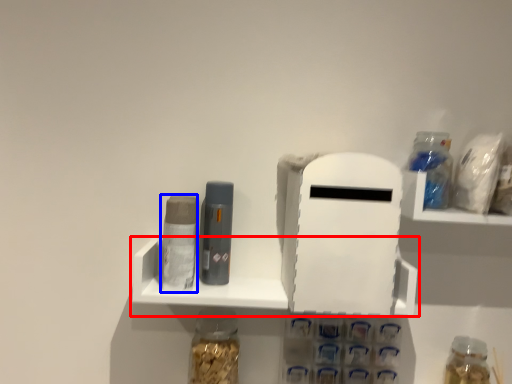
Question: Which of the following is the farthest to the observer, shelf (highlighted by a red box) or toiletry (highlighted by a blue box)?

Choices:
 (A) shelf
 (B) toiletry

Answer: (A)